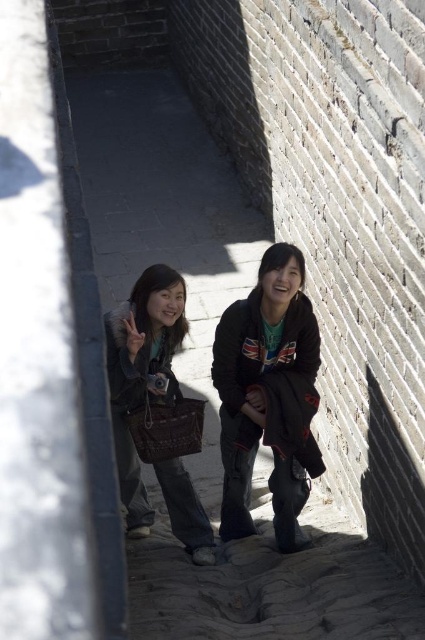
Looking at this image, can you confirm if dark brown leather jacket at center is taller than matte brown jacket at center?

Correct, dark brown leather jacket at center is much taller as matte brown jacket at center.

Does point (243, 524) come in front of point (172, 484)?

No, (243, 524) is further to viewer.

Where is `dark brown leather jacket at center`? The width and height of the screenshot is (425, 640). dark brown leather jacket at center is located at coordinates (269, 396).